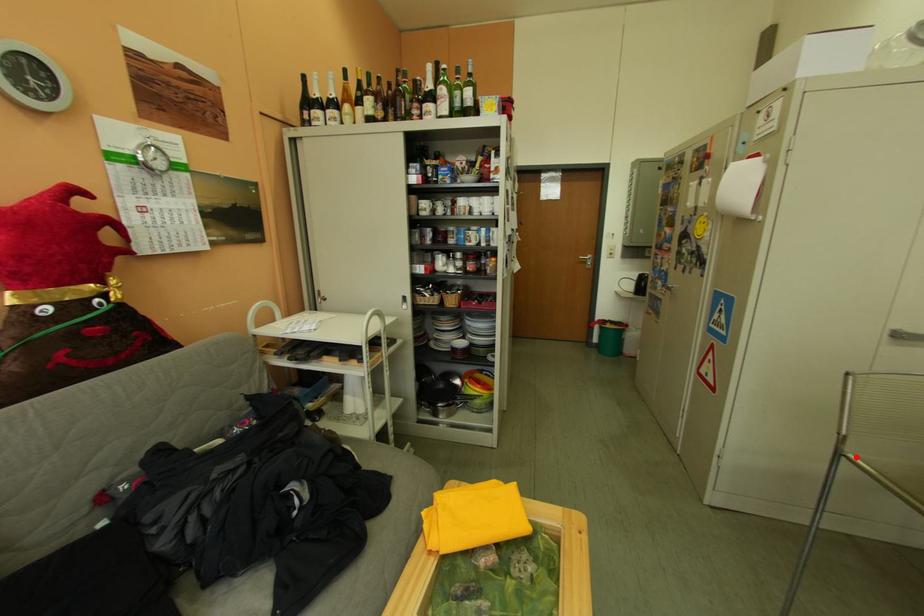
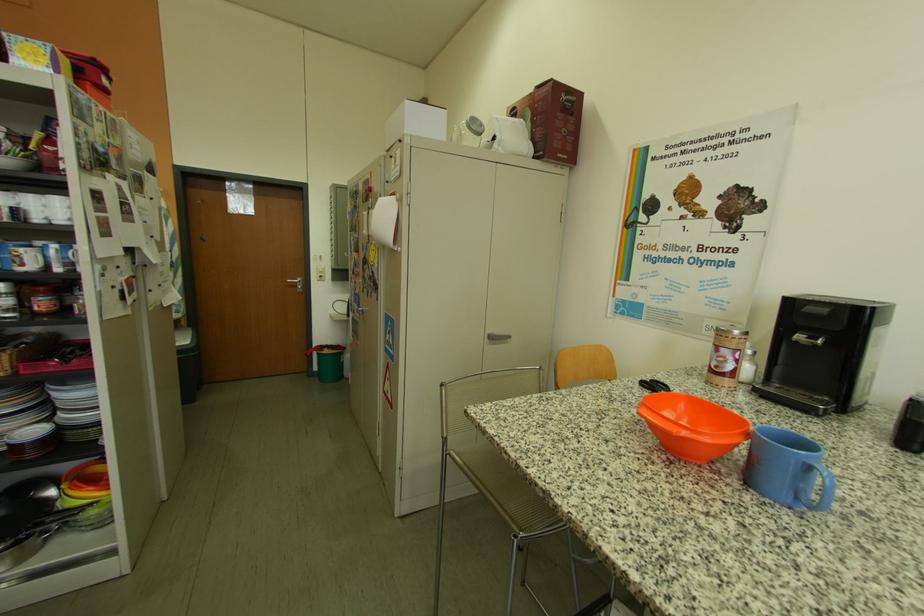
Find the pixel in the second image that matches the highlighted location in the first image.

(460, 456)